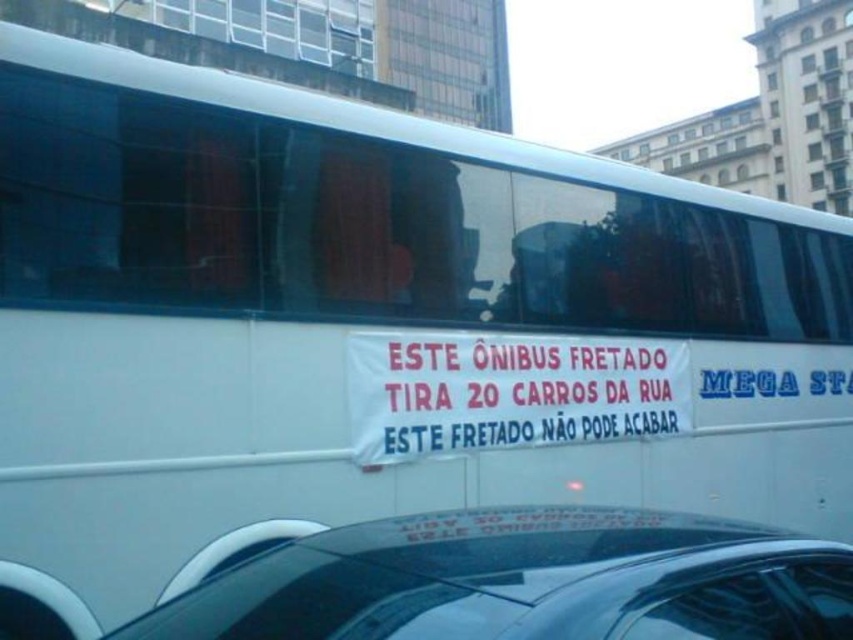
You are a pedestrian standing on the sidewalk looking at the scene. Which object is positioned lower in the image, the black glossy car at lower center or the white paper banner at center?

The black glossy car at lower center is positioned lower in the image than the white paper banner at center.

Looking at this image, you are a pedestrian standing on the sidewalk. You see a black glossy car at lower center and a white paper banner at center. Which object is closer to you?

The black glossy car at lower center is closer to you because it is in front of the white paper banner at center.